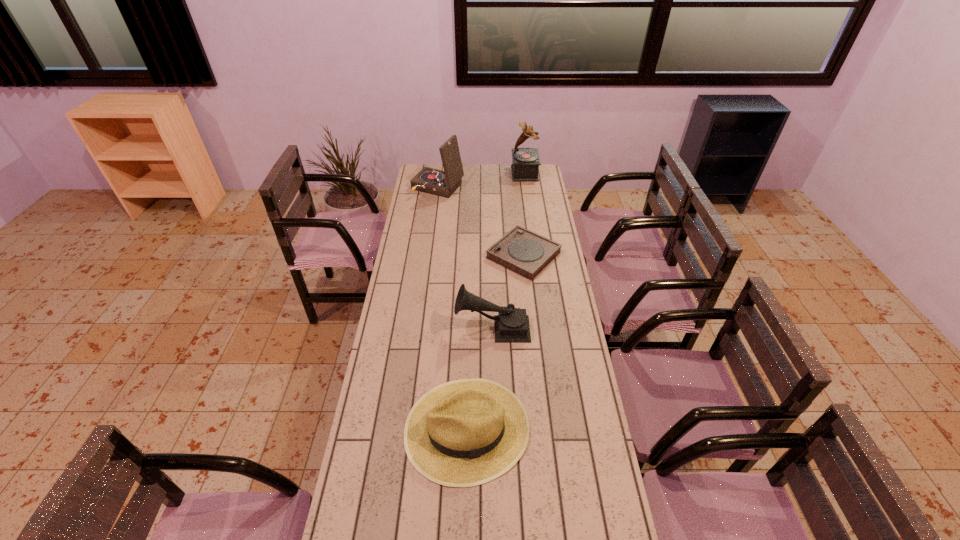
Find the location of a particular element. Image resolution: width=960 pixels, height=540 pixels. the nearest phonograph record is located at coordinates (511, 324).

I want to click on the third tallest object, so click(x=511, y=324).

Locate an element on the screen. The height and width of the screenshot is (540, 960). the fourth tallest object is located at coordinates (462, 433).

Identify the location of sunhat. (462, 433).

Find the location of a particular element. the third farthest object is located at coordinates (522, 251).

Identify the location of the second nearest phonograph record. (522, 251).

Where is `free space located from the horn of the nearest phonograph record`? The image size is (960, 540). free space located from the horn of the nearest phonograph record is located at coordinates click(387, 327).

Identify the location of vacant area situated from the horn of the nearest phonograph record. The width and height of the screenshot is (960, 540). (396, 327).

Locate an element on the screen. Image resolution: width=960 pixels, height=540 pixels. vacant region located 0.260m from the horn of the nearest phonograph record is located at coordinates click(389, 327).

Identify the location of vacant region located on the back of the nearest object. The height and width of the screenshot is (540, 960). (469, 298).